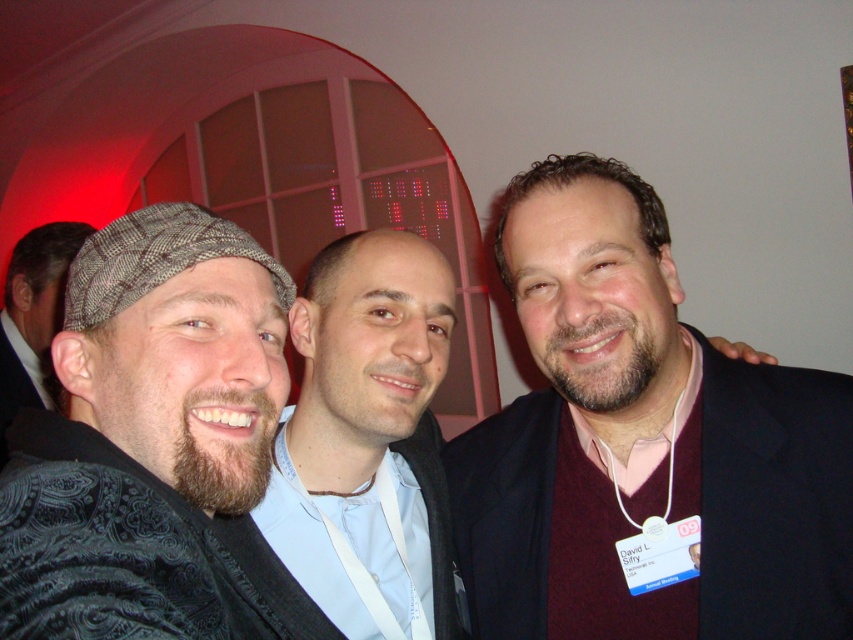
You are organizing a photo shoot and need to ensure that all subjects fit within a frame that can only accommodate the size of the bearded man with textured hat at left. Can the maroon sweater at right be included without exceeding the frame size?

The maroon sweater at right occupies less space than the bearded man with textured hat at left, so it can be included in the frame without exceeding the size limit.

You are organizing a charity event and need to place a small donation box between the maroon sweater at right and the dark gray textured cap at left. The donation box is 12 inches wide. Can you fit it between them?

The maroon sweater at right is larger than the dark gray textured cap at left, but the exact distance between them isn not specified. Without knowing the space between the two items, it is impossible to determine if the donation box will fit.